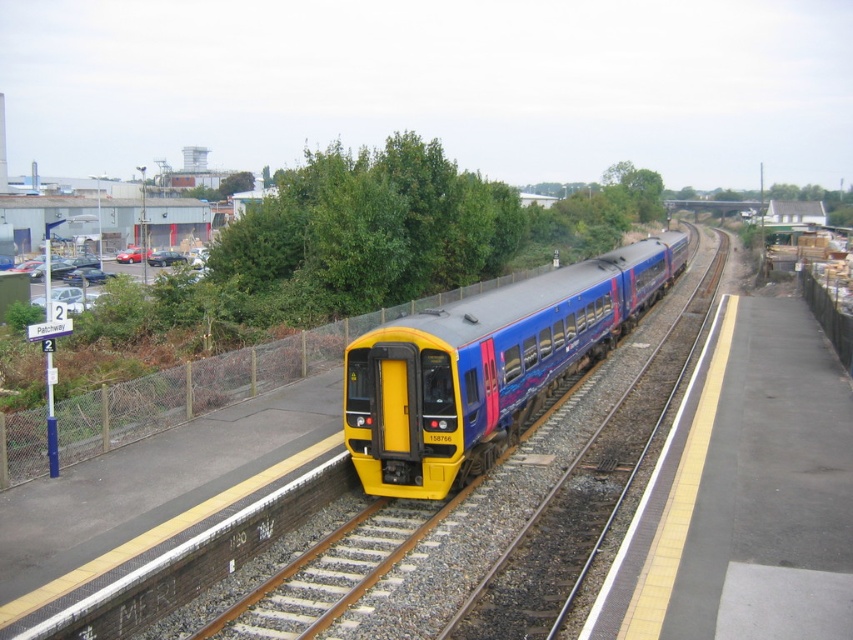
Question: Does matte blue train at center appear over green leafy tree at upper center?

Choices:
 (A) yes
 (B) no

Answer: (B)

Question: Does matte blue train at center have a smaller size compared to green leafy tree at upper center?

Choices:
 (A) yes
 (B) no

Answer: (A)

Question: Is matte blue train at center thinner than green leafy tree at upper center?

Choices:
 (A) yes
 (B) no

Answer: (B)

Question: Which point appears farthest from the camera in this image?

Choices:
 (A) (630, 204)
 (B) (418, 388)

Answer: (A)